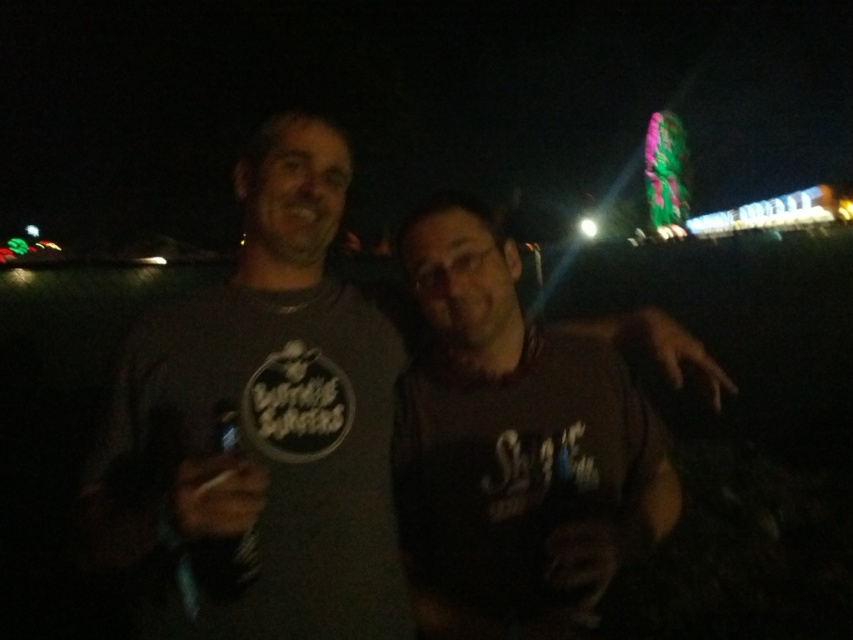
Question: Does dark gray t-shirt at center have a greater width compared to dark brown fabric shirt at center?

Choices:
 (A) yes
 (B) no

Answer: (B)

Question: Which point is closer to the camera taking this photo?

Choices:
 (A) (364, 499)
 (B) (439, 355)

Answer: (A)

Question: Does dark gray t-shirt at center appear under dark brown fabric shirt at center?

Choices:
 (A) yes
 (B) no

Answer: (B)

Question: Which of the following is the closest to the observer?

Choices:
 (A) dark brown fabric shirt at center
 (B) dark gray t-shirt at center

Answer: (B)

Question: Does dark gray t-shirt at center appear on the right side of dark brown fabric shirt at center?

Choices:
 (A) no
 (B) yes

Answer: (A)

Question: Which of the following is the closest to the observer?

Choices:
 (A) (590, 401)
 (B) (163, 637)

Answer: (B)